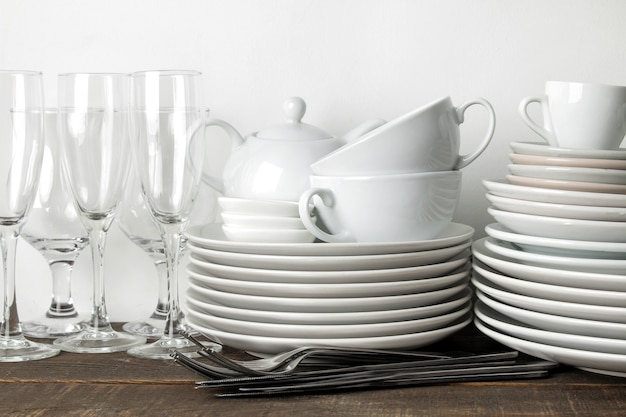
I want to click on silverware, so click(x=262, y=359), click(x=288, y=364), click(x=221, y=367), click(x=208, y=371), click(x=217, y=379), click(x=206, y=385), click(x=237, y=394), click(x=254, y=390).